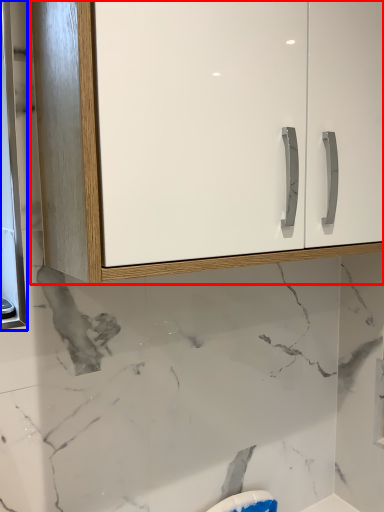
Question: Among these objects, which one is nearest to the camera, cabinetry (highlighted by a red box) or medicine cabinet (highlighted by a blue box)?

Choices:
 (A) cabinetry
 (B) medicine cabinet

Answer: (A)